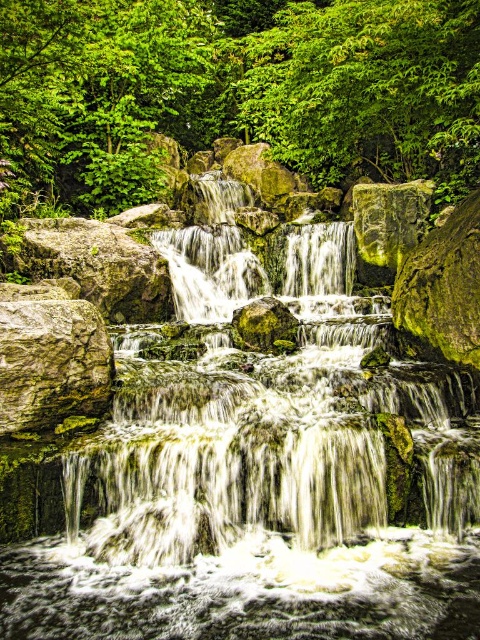
Who is lower down, green mossy rocks at center or rough textured rock at left?

rough textured rock at left

Who is more distant from viewer, (219, 529) or (72, 348)?

Point (72, 348)

Is point (384, 502) closer to viewer compared to point (93, 308)?

Yes, point (384, 502) is closer to viewer.

Where is `green mossy rocks at center`? The image size is (480, 640). green mossy rocks at center is located at coordinates (252, 474).

Consider the image. Can you confirm if green mossy rocks at center is bigger than green mossy rock at left?

Yes, green mossy rocks at center is bigger than green mossy rock at left.

You are a GUI agent. You are given a task and a screenshot of the screen. Output one action in this format:
    pyautogui.click(x=<x>, y=<y>)
    Task: Click on the green mossy rocks at center
    
    Given the screenshot: What is the action you would take?
    pyautogui.click(x=252, y=474)

Does green mossy rock at left have a greater height compared to green mossy rock at center-right?

No.

The image size is (480, 640). What are the coordinates of `green mossy rock at left` in the screenshot? It's located at (99, 266).

This screenshot has height=640, width=480. Find the location of `green mossy rock at left`. green mossy rock at left is located at coordinates (99, 266).